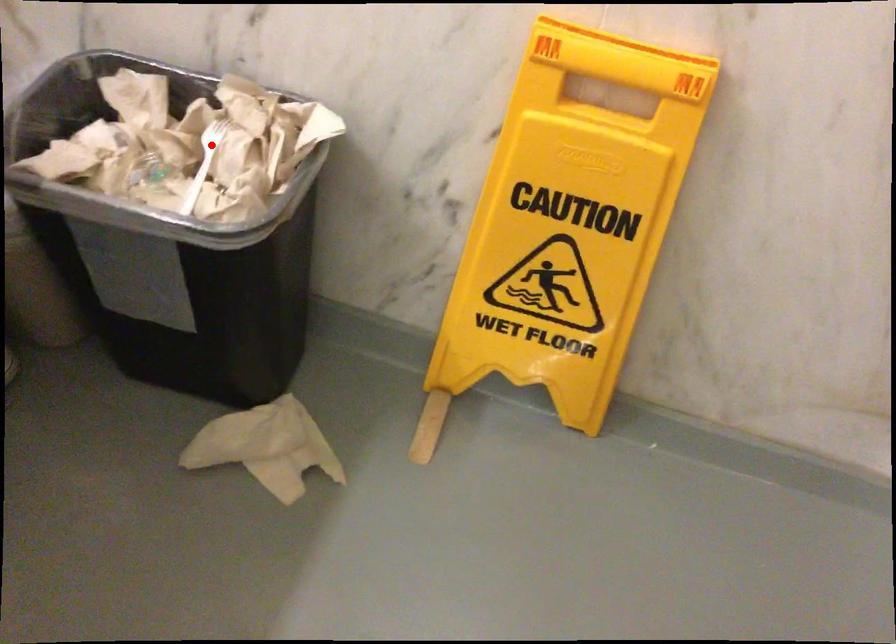
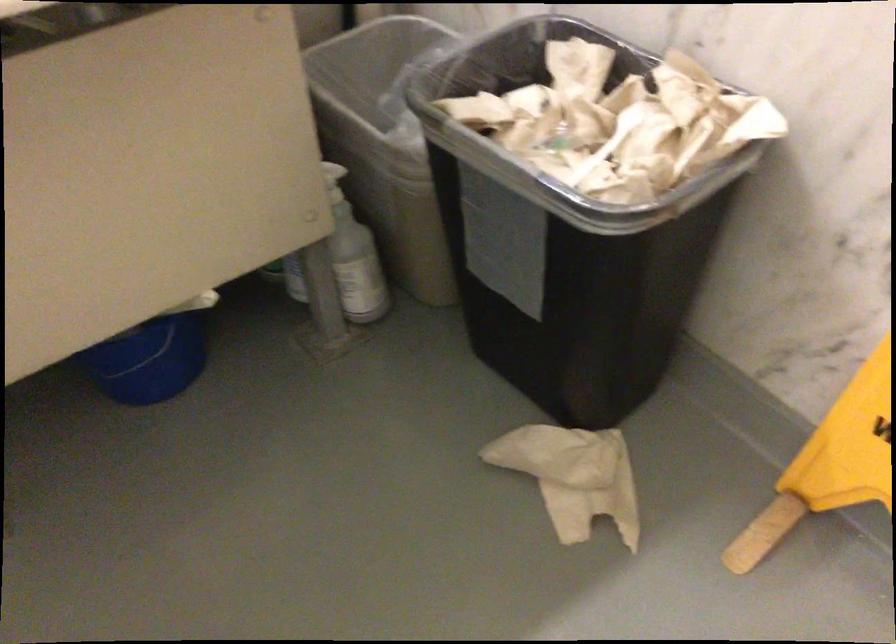
Question: A red point is marked in image1. In image2, is the corresponding 3D point closer to the camera or farther? Reply with the corresponding letter.

Choices:
 (A) The corresponding 3D point is closer.
 (B) The corresponding 3D point is farther.

Answer: (A)